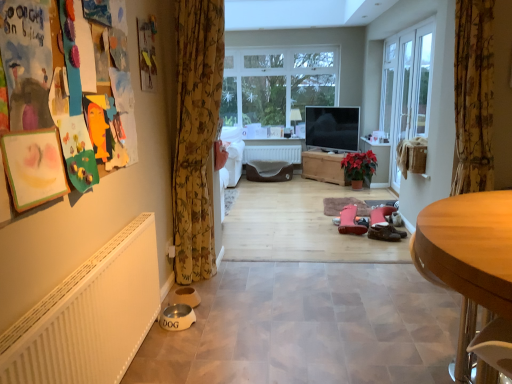
Question: Should I look upward or downward to see white matte radiator at center?

Choices:
 (A) up
 (B) down

Answer: (A)

Question: From a real-world perspective, is white glass screen door at right located beneath red matte poinsettia at center?

Choices:
 (A) yes
 (B) no

Answer: (B)

Question: From the image's perspective, is white glass screen door at right located beneath red matte poinsettia at center?

Choices:
 (A) no
 (B) yes

Answer: (A)

Question: Does white glass screen door at right have a smaller size compared to red matte poinsettia at center?

Choices:
 (A) yes
 (B) no

Answer: (B)

Question: Is white glass screen door at right turned away from red matte poinsettia at center?

Choices:
 (A) no
 (B) yes

Answer: (A)

Question: Is white glass screen door at right further to camera compared to red matte poinsettia at center?

Choices:
 (A) yes
 (B) no

Answer: (B)

Question: From a real-world perspective, is white glass screen door at right on top of red matte poinsettia at center?

Choices:
 (A) yes
 (B) no

Answer: (A)

Question: From the image's perspective, is red matte poinsettia at center above pink suede boots at center, the first footwear from the back?

Choices:
 (A) no
 (B) yes

Answer: (B)

Question: Is red matte poinsettia at center not near pink suede boots at center, the first footwear from the back?

Choices:
 (A) no
 (B) yes

Answer: (B)

Question: Is red matte poinsettia at center outside pink suede boots at center, the first footwear from the back?

Choices:
 (A) yes
 (B) no

Answer: (A)

Question: Considering the relative positions of red matte poinsettia at center and pink suede boots at center, the first footwear from the back, in the image provided, is red matte poinsettia at center to the right of pink suede boots at center, the first footwear from the back, from the viewer's perspective?

Choices:
 (A) yes
 (B) no

Answer: (A)

Question: Does red matte poinsettia at center turn towards pink suede boots at center, the first footwear from the back?

Choices:
 (A) no
 (B) yes

Answer: (B)

Question: Does red matte poinsettia at center have a lesser width compared to pink suede boots at center, the 2th footwear in the front-to-back sequence?

Choices:
 (A) no
 (B) yes

Answer: (B)

Question: From the image's perspective, would you say red matte poinsettia at center is shown under floral fabric curtain at right, the 1th curtain positioned from the right?

Choices:
 (A) yes
 (B) no

Answer: (A)